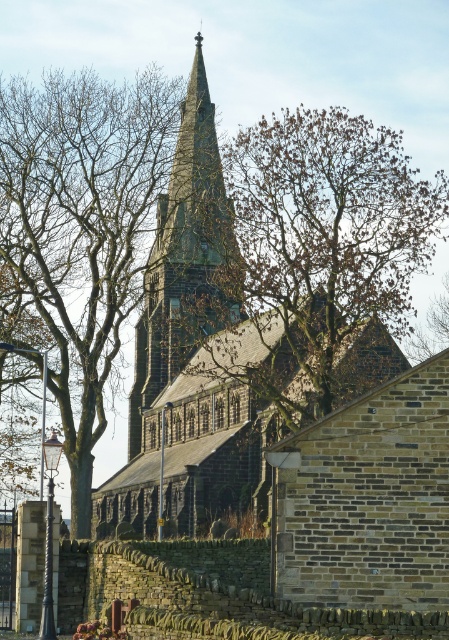
Which is below, bare branches at center or brown leafy tree at center?

Positioned lower is bare branches at center.

Describe the element at coordinates (83, 228) in the screenshot. The height and width of the screenshot is (640, 449). I see `bare branches at center` at that location.

Where is `bare branches at center`? The width and height of the screenshot is (449, 640). bare branches at center is located at coordinates (83, 228).

Does bare branches at center appear on the right side of dark gray stone steeple at center?

No, bare branches at center is not to the right of dark gray stone steeple at center.

Is point (82, 193) farther from viewer compared to point (206, 128)?

No, (82, 193) is in front of (206, 128).

The height and width of the screenshot is (640, 449). I want to click on bare branches at center, so click(x=83, y=228).

Does point (306, 273) come closer to viewer compared to point (215, 227)?

Yes, point (306, 273) is closer to viewer.

Does brown leafy tree at center come in front of dark gray stone steeple at center?

Yes, it is.

Between point (432, 248) and point (180, 262), which one is positioned behind?

Positioned behind is point (180, 262).

Where is `brown leafy tree at center`? brown leafy tree at center is located at coordinates pyautogui.click(x=328, y=236).